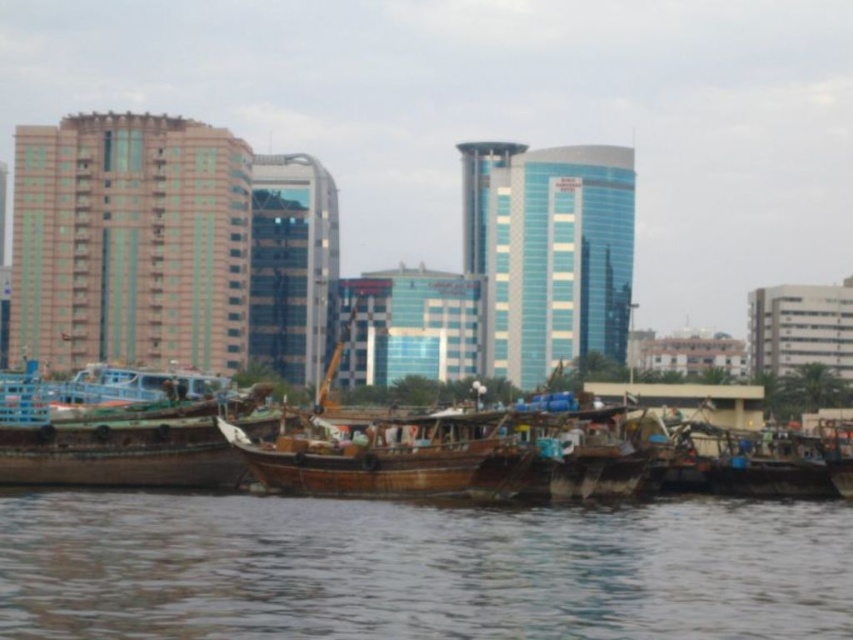
You are a delivery person needing to move a package from the wooden boat at left to the wooden boat at center. The package requires a minimum of 7 meters of space between the two boats to be safely transported. Can you safely move the package?

The wooden boat at left and wooden boat at center are 7.01 meters apart from each other. Since 7.01 meters is just over the required 7 meters, you can safely move the package between them.

You are navigating a small boat that requires a minimum depth of 0.5 meters to avoid damage. According to the coordinates provided, is the brown water at lower center suitable for your boat to pass through safely?

The brown water at lower center is located at coordinates point (419, 568). Since the minimum depth required is 0.5 meters and the y coordinate 0.492 is just below 0.5, the water depth might be insufficient, so it is not safe for the boat to pass through.

Consider the image. You are a photographer planning to capture the waterfront scene. You want to ensure that the brown water at lower center and the wooden boat at left are both visible in your photo. Given their sizes, which object will occupy more space in the final image?

The brown water at lower center is larger in size than the wooden boat at left, so it will occupy more space in the final image.